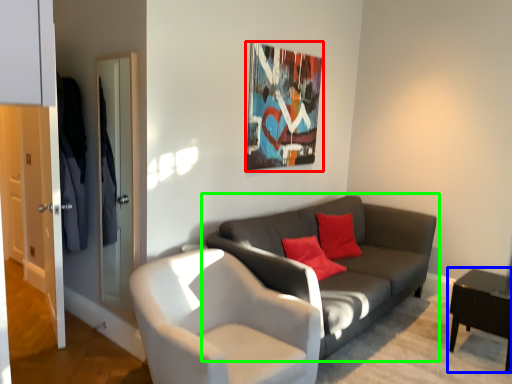
Question: Which is farther away from picture frame (highlighted by a red box)? table (highlighted by a blue box) or studio couch (highlighted by a green box)?

Choices:
 (A) table
 (B) studio couch

Answer: (A)